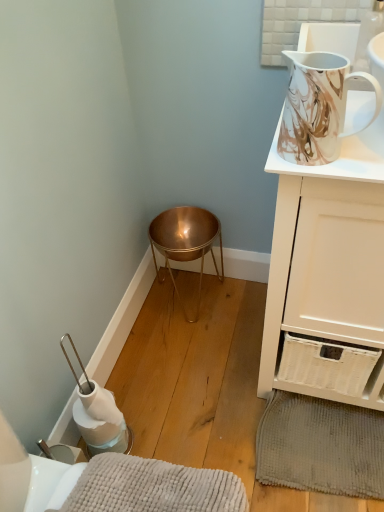
Question: Is copper metallic bowl at lower center located outside white glossy cabinet at upper right?

Choices:
 (A) yes
 (B) no

Answer: (A)

Question: Is copper metallic bowl at lower center facing towards white glossy cabinet at upper right?

Choices:
 (A) no
 (B) yes

Answer: (A)

Question: Is copper metallic bowl at lower center not near white glossy cabinet at upper right?

Choices:
 (A) yes
 (B) no

Answer: (B)

Question: Can you confirm if copper metallic bowl at lower center is bigger than white glossy cabinet at upper right?

Choices:
 (A) no
 (B) yes

Answer: (A)

Question: Can you confirm if copper metallic bowl at lower center is positioned to the left of white glossy cabinet at upper right?

Choices:
 (A) yes
 (B) no

Answer: (A)

Question: Is copper metallic bowl at lower center positioned behind white glossy cabinet at upper right?

Choices:
 (A) no
 (B) yes

Answer: (B)

Question: Is gray textured bath mat at lower right, acting as the 1th bath mat starting from the right, located outside copper metallic bowl at lower center?

Choices:
 (A) no
 (B) yes

Answer: (B)

Question: From a real-world perspective, is gray textured bath mat at lower right, the 2th bath mat in the front-to-back sequence, positioned over copper metallic bowl at lower center based on gravity?

Choices:
 (A) no
 (B) yes

Answer: (A)

Question: Is gray textured bath mat at lower right, the 2th bath mat in the front-to-back sequence, far away from copper metallic bowl at lower center?

Choices:
 (A) yes
 (B) no

Answer: (B)

Question: Can you confirm if gray textured bath mat at lower right, the 2th bath mat in the front-to-back sequence, is wider than copper metallic bowl at lower center?

Choices:
 (A) yes
 (B) no

Answer: (A)

Question: From the image's perspective, is gray textured bath mat at lower right, acting as the 1th bath mat starting from the right, on top of copper metallic bowl at lower center?

Choices:
 (A) yes
 (B) no

Answer: (B)

Question: Is gray textured bath mat at lower right, which appears as the 1th bath mat when viewed from the back, closer to the viewer compared to copper metallic bowl at lower center?

Choices:
 (A) yes
 (B) no

Answer: (A)

Question: Is gray textured bath mat at lower right, which appears as the 1th bath mat when viewed from the back, turned away from marble-patterned ceramic jug at upper right?

Choices:
 (A) yes
 (B) no

Answer: (B)